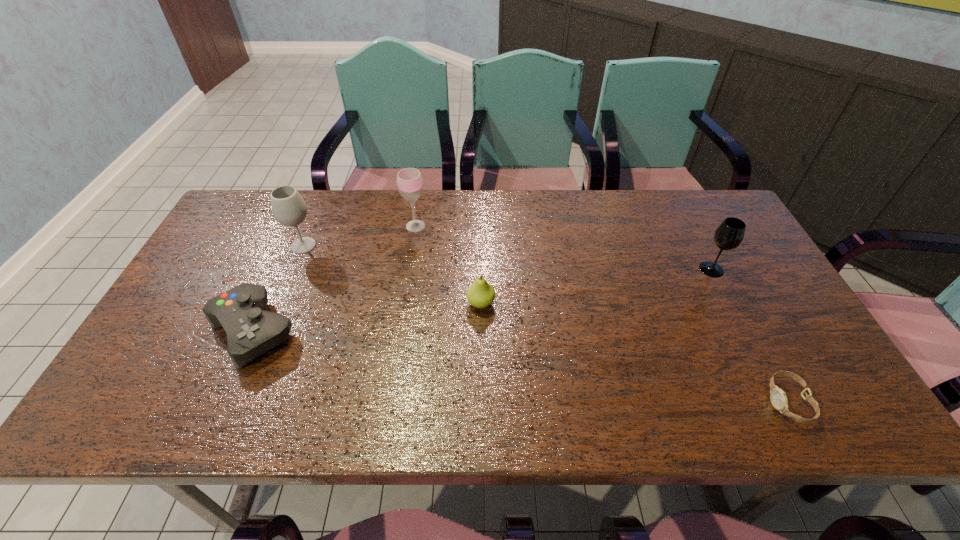
Find the location of a particular element. The height and width of the screenshot is (540, 960). free space between the nearest object and the second wineglass from left to right is located at coordinates (602, 314).

The height and width of the screenshot is (540, 960). What are the coordinates of `vacant space that's between the shortest object and the third object from right to left` in the screenshot? It's located at (635, 353).

Where is `blank region between the fourth nearest object and the pear`? This screenshot has width=960, height=540. blank region between the fourth nearest object and the pear is located at coordinates (596, 286).

Find the location of a particular element. vacant space that is in between the fourth object from right to left and the nearest wineglass is located at coordinates (564, 247).

Where is `free spot between the third farthest object and the nearest object`? free spot between the third farthest object and the nearest object is located at coordinates (750, 335).

Find the location of a particular element. This screenshot has width=960, height=540. vacant area that lies between the second nearest wineglass and the nearest object is located at coordinates (545, 323).

Identify which object is located as the second nearest to the nearest wineglass. Please provide its 2D coordinates. Your answer should be formatted as a tuple, i.e. [(x, y)], where the tuple contains the x and y coordinates of a point satisfying the conditions above.

[(481, 294)]

Locate which object is the fourth closest to the nearest wineglass. Please provide its 2D coordinates. Your answer should be formatted as a tuple, i.e. [(x, y)], where the tuple contains the x and y coordinates of a point satisfying the conditions above.

[(251, 331)]

Locate an element on the screen. wineglass that is the second closest one to the fifth nearest object is located at coordinates (729, 235).

Identify which wineglass is the second nearest to the nearest object. Please provide its 2D coordinates. Your answer should be formatted as a tuple, i.e. [(x, y)], where the tuple contains the x and y coordinates of a point satisfying the conditions above.

[(409, 180)]